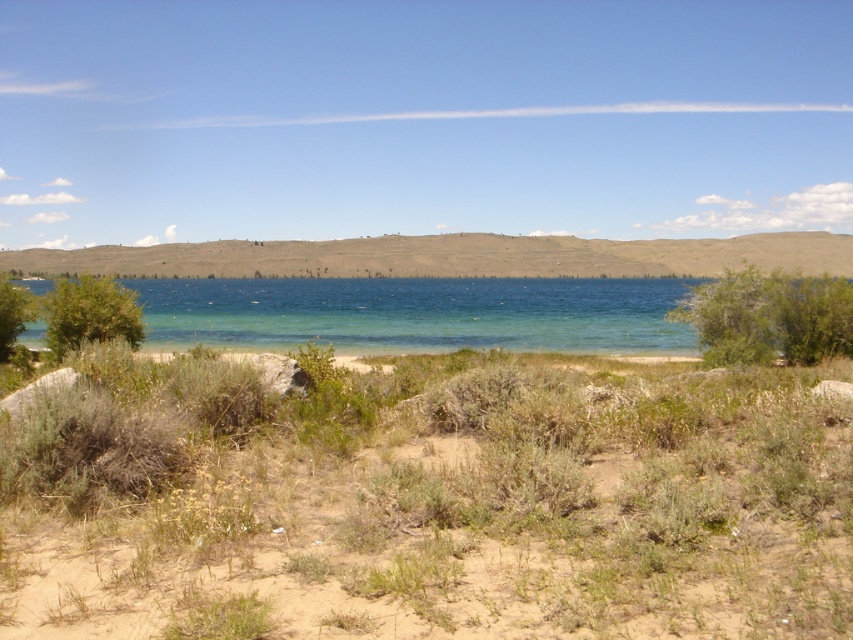
You are standing at the point marked by the coordinates point (428,502) in the image. Looking around, you notice brown sandy soil at lower center. Which direction should you walk to reach the green bushes and trees near the water edge?

The point marked by the coordinates point (428,502) is located at the brown sandy soil at lower center. To reach the green bushes and trees near the water edge, you should walk towards the upper direction since the green bushes and trees are positioned along the edge of the water, which is likely in the upper part of the image relative to the lower center position.

You are standing at the shoreline of the serene lake and want to reach a specific point marked at coordinates point [78,630]. Given that you can walk 20 feet per minute, how many minutes will it take you to reach that point?

The distance of point [78,630] from viewer is 18.24 feet. At a walking speed of 20 feet per minute, it will take approximately 0.912 minutes, which is roughly 55 seconds, to reach the point.

You are standing on the sandy shoreline and want to walk to the green leafy bush at right. Which direction should you go relative to the green leafy bush at left?

You should go to the right of the green leafy bush at left because the green leafy bush at right is positioned under it, meaning it is located to the right side from the observer perspective.